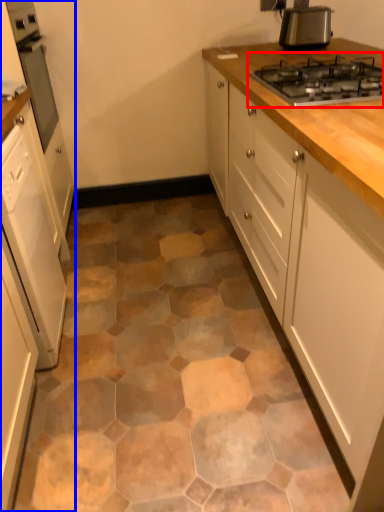
Question: Among these objects, which one is nearest to the camera, gas stove (highlighted by a red box) or cabinetry (highlighted by a blue box)?

Choices:
 (A) gas stove
 (B) cabinetry

Answer: (B)